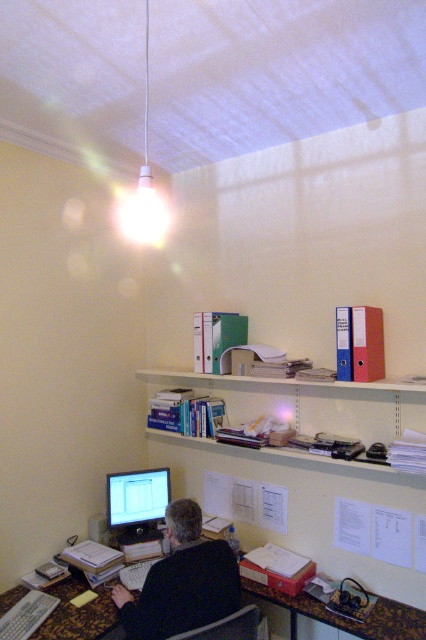
Question: Does white matte lamp at upper center lie in front of dark gray fabric chair at lower center?

Choices:
 (A) no
 (B) yes

Answer: (B)

Question: Which of these objects is positioned closest to the matte black monitor at lower center?

Choices:
 (A) dark gray fabric chair at lower center
 (B) white glossy bookshelf at upper center
 (C) brown wood table at lower center

Answer: (C)

Question: Does black fabric person at lower center appear on the right side of white matte lamp at upper center?

Choices:
 (A) yes
 (B) no

Answer: (A)

Question: Is brown wood table at lower center positioned before white matte lamp at upper center?

Choices:
 (A) no
 (B) yes

Answer: (A)

Question: Which object is farther from the camera taking this photo?

Choices:
 (A) brown wood table at lower center
 (B) white glossy bookshelf at upper center
 (C) black fabric person at lower center
 (D) dark gray fabric chair at lower center

Answer: (B)

Question: Which point appears closest to the camera in this image?

Choices:
 (A) click(241, 612)
 (B) click(131, 234)
 (C) click(190, 541)
 (D) click(149, 520)

Answer: (A)